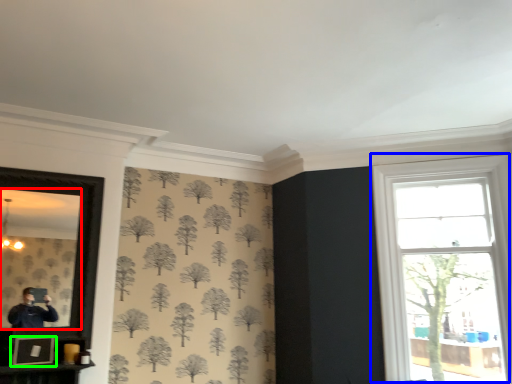
Question: Considering the real-world distances, which object is farthest from mirror (highlighted by a red box)? window (highlighted by a blue box) or picture frame (highlighted by a green box)?

Choices:
 (A) window
 (B) picture frame

Answer: (A)